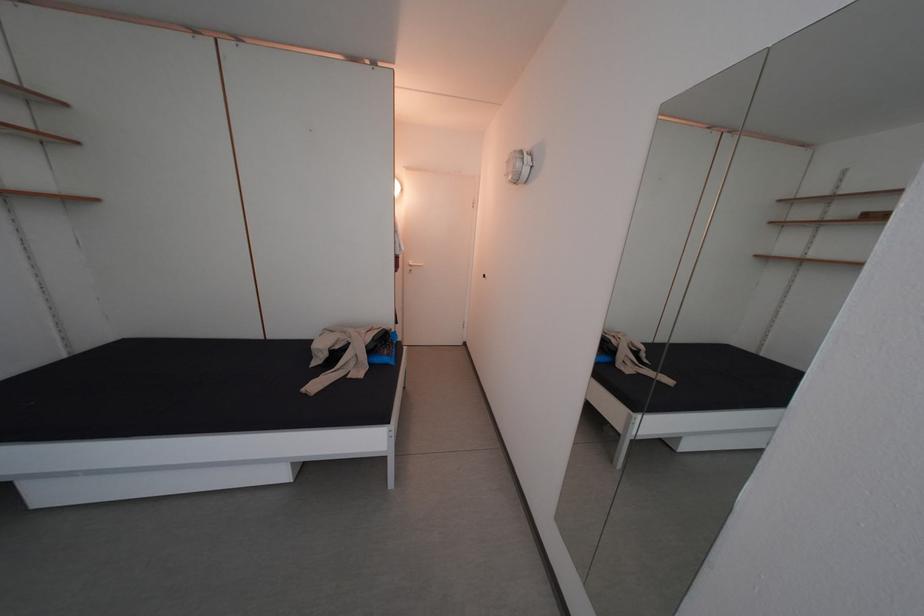
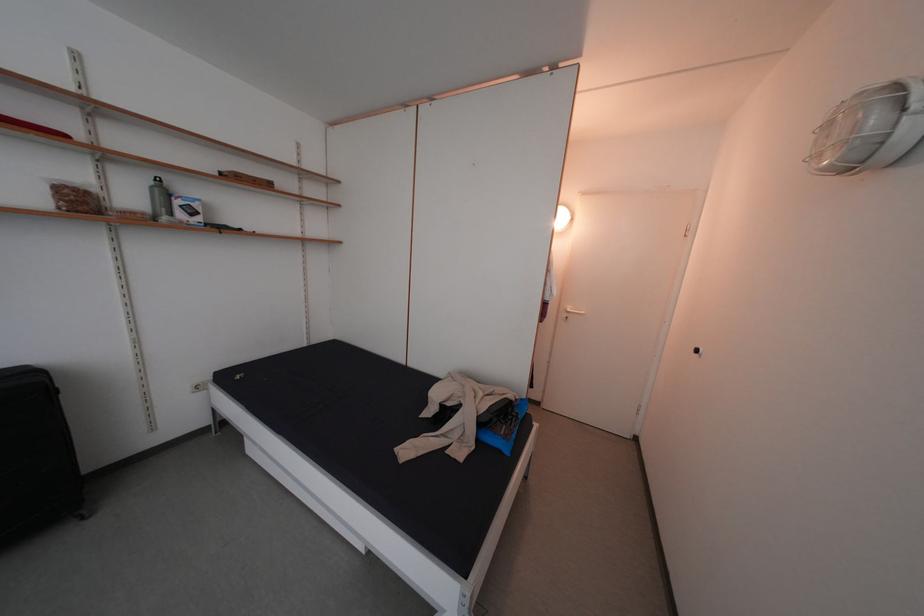
Question: The camera is either moving clockwise (left) or counter-clockwise (right) around the object. The first image is from the beginning of the video and the second image is from the end. Is the camera moving left or right when shooting the video?

Choices:
 (A) Left
 (B) Right

Answer: (B)